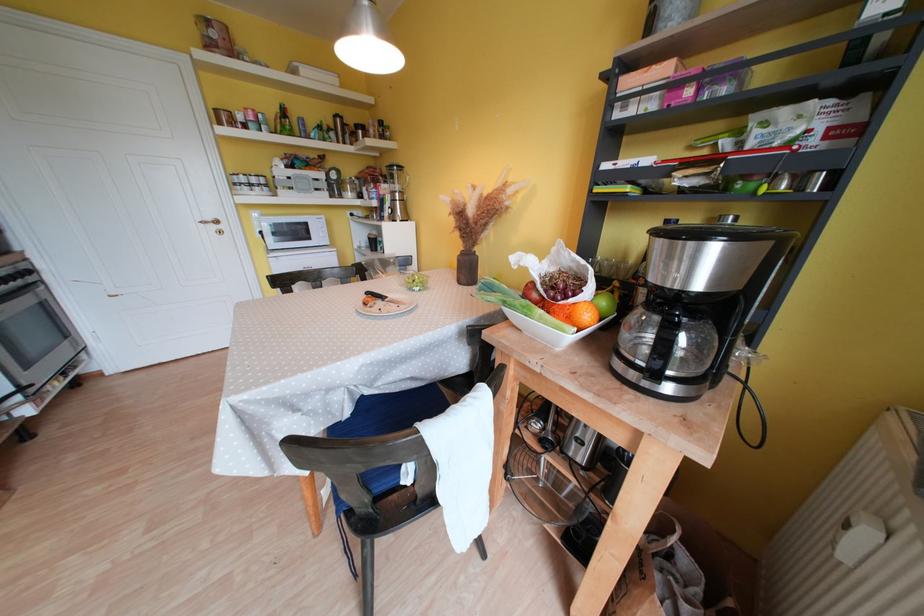
Which object does [575,313] point to?

This point indicates the orange fruit.